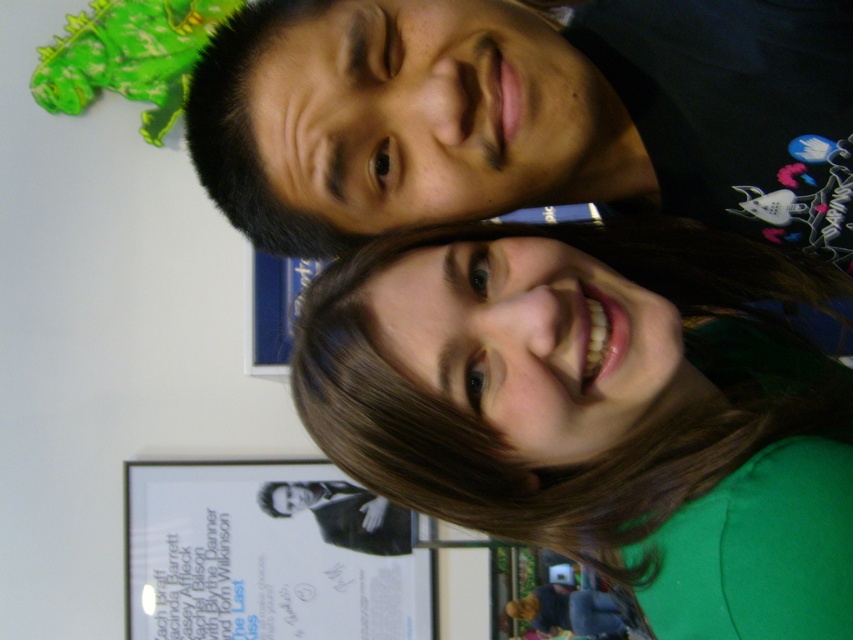
Does green matte shirt at lower right appear on the right side of matte black shirt at upper center?

Yes, green matte shirt at lower right is to the right of matte black shirt at upper center.

Does point (463, 436) come in front of point (480, 144)?

No.

At what (x,y) coordinates should I click in order to perform the action: click on green matte shirt at lower right. Please return your answer as a coordinate pair (x, y). Image resolution: width=853 pixels, height=640 pixels. Looking at the image, I should click on (599, 410).

Can you confirm if matte black shirt at upper center is bigger than black suit at center?

Correct, matte black shirt at upper center is larger in size than black suit at center.

Which is below, matte black shirt at upper center or black suit at center?

black suit at center

Which is in front, point (495, 198) or point (305, 490)?

Positioned in front is point (495, 198).

Where is `matte black shirt at upper center`? The image size is (853, 640). matte black shirt at upper center is located at coordinates (526, 115).

Who is more forward, [650,330] or [381,547]?

Point [650,330] is in front.

Which is more to the right, green matte shirt at lower right or black suit at center?

From the viewer's perspective, green matte shirt at lower right appears more on the right side.

Find the location of `green matte shirt at lower right`. green matte shirt at lower right is located at coordinates (599, 410).